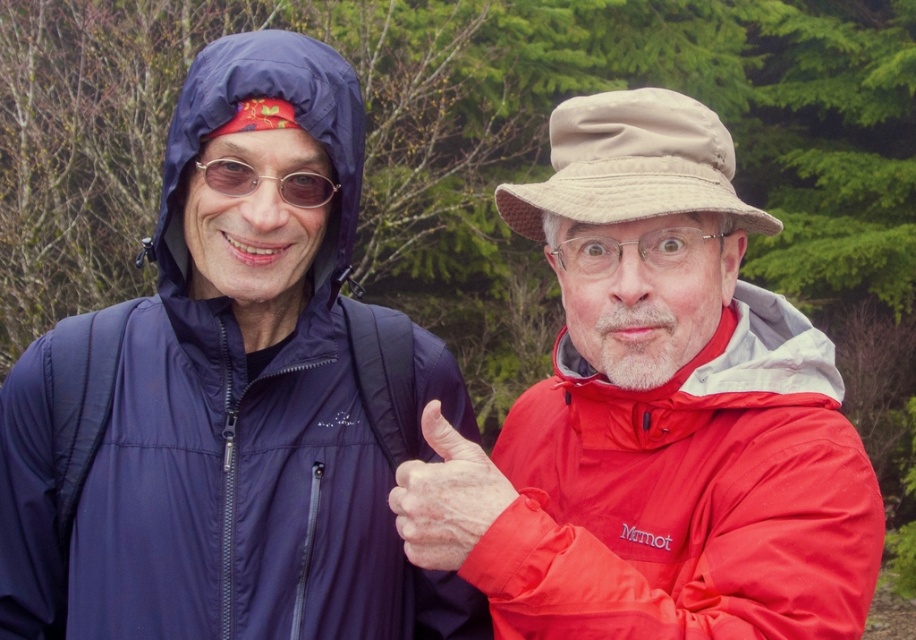
Based on the photo, can you confirm if navy blue waterproof jacket at left is thinner than smooth skin hand at center?

No.

Can you confirm if navy blue waterproof jacket at left is taller than smooth skin hand at center?

A: Correct, navy blue waterproof jacket at left is much taller as smooth skin hand at center.

This screenshot has width=916, height=640. Find the location of `navy blue waterproof jacket at left`. navy blue waterproof jacket at left is located at coordinates (226, 404).

Identify the location of navy blue waterproof jacket at left. The height and width of the screenshot is (640, 916). (226, 404).

Between matte red jacket at right and smooth skin hand at center, which one is positioned lower?

Positioned lower is smooth skin hand at center.

Is point (660, 116) closer to viewer compared to point (456, 509)?

That is False.

Locate an element on the screen. This screenshot has width=916, height=640. matte red jacket at right is located at coordinates (655, 416).

Locate an element on the screen. matte red jacket at right is located at coordinates (655, 416).

Can you confirm if navy blue waterproof jacket at left is smaller than matte red jacket at right?

Correct, navy blue waterproof jacket at left occupies less space than matte red jacket at right.

Does point (217, 573) lie in front of point (635, 289)?

No, it is not.

Which is behind, point (187, 186) or point (426, 561)?

Positioned behind is point (187, 186).

Locate an element on the screen. navy blue waterproof jacket at left is located at coordinates (226, 404).